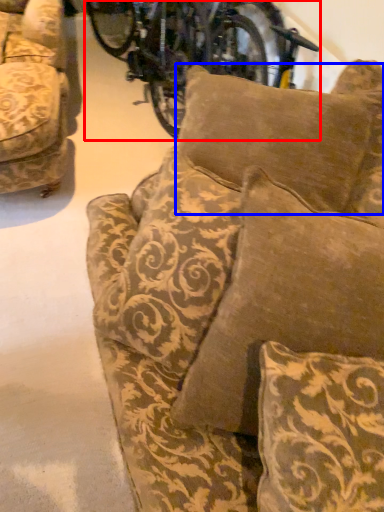
Question: Which of the following is the closest to the observer, bicycle (highlighted by a red box) or pillow (highlighted by a blue box)?

Choices:
 (A) bicycle
 (B) pillow

Answer: (B)